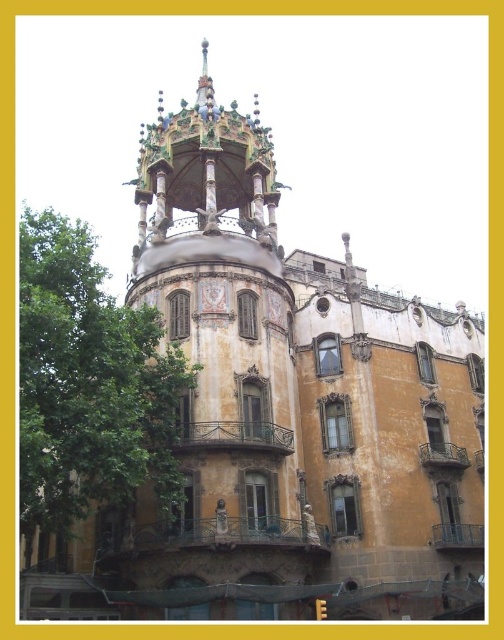
Is yellowish textured building at center taller than green leafy tree at left?

Yes, yellowish textured building at center is taller than green leafy tree at left.

Who is shorter, yellowish textured building at center or green leafy tree at left?

With less height is green leafy tree at left.

The width and height of the screenshot is (504, 640). What are the coordinates of `yellowish textured building at center` in the screenshot? It's located at (x=222, y=374).